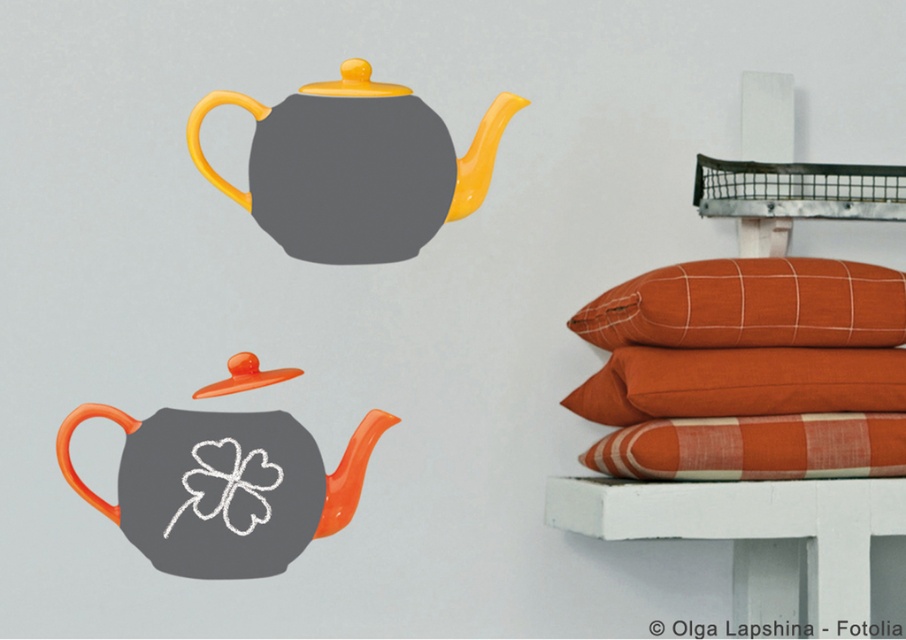
Question: Which point appears closest to the camera in this image?

Choices:
 (A) 142,465
 (B) 413,241
 (C) 755,289

Answer: (A)

Question: Which point is closer to the camera?

Choices:
 (A) (690, 371)
 (B) (393, 145)

Answer: (B)

Question: Is matte orange teapot at center to the right of orange cotton pillow at upper right from the viewer's perspective?

Choices:
 (A) yes
 (B) no

Answer: (B)

Question: Can you confirm if matte orange teapot at upper center is thinner than orange cotton pillow at right?

Choices:
 (A) no
 (B) yes

Answer: (B)

Question: Can you confirm if matte orange teapot at upper center is positioned to the right of orange cotton pillow at upper right?

Choices:
 (A) no
 (B) yes

Answer: (A)

Question: Which point is farther to the camera?

Choices:
 (A) (897, 291)
 (B) (677, 410)
 (C) (294, 422)
 (D) (747, 480)

Answer: (A)